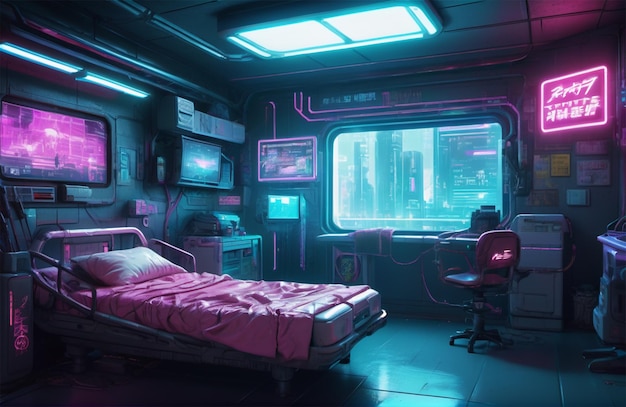
Locate an element on the screen. This screenshot has width=626, height=407. window is located at coordinates (414, 188).